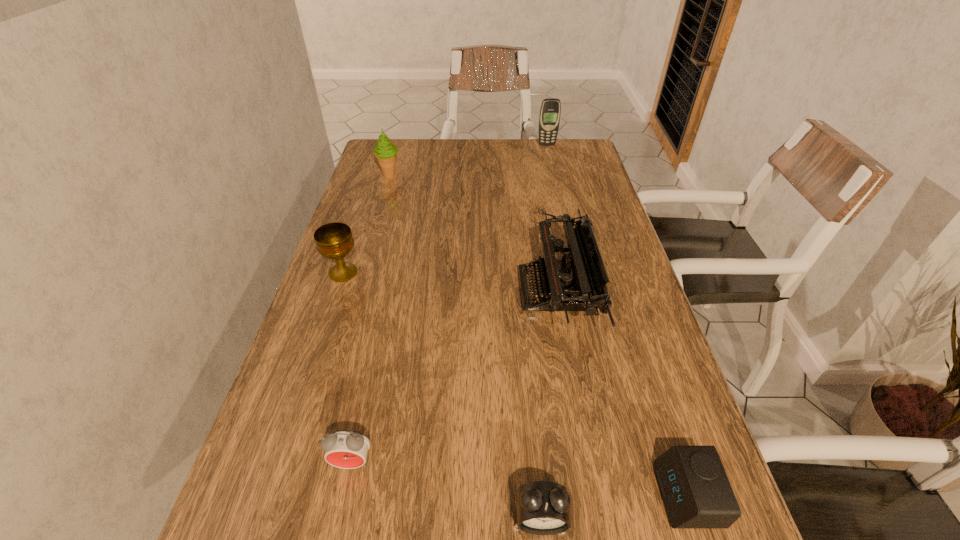
At what (x,y) coordinates should I click in order to perform the action: click on free region located on the typing side of the typewriter. Please return your answer as a coordinate pair (x, y). The height and width of the screenshot is (540, 960). Looking at the image, I should click on pyautogui.click(x=395, y=291).

Identify the location of vacant space located 0.260m on the typing side of the typewriter. The width and height of the screenshot is (960, 540). (412, 291).

At what (x,y) coordinates should I click in order to perform the action: click on vacant point located 0.390m on the typing side of the typewriter. Please return your answer as a coordinate pair (x, y). This screenshot has width=960, height=540. Looking at the image, I should click on (357, 291).

You are a GUI agent. You are given a task and a screenshot of the screen. Output one action in this format:
    pyautogui.click(x=<x>, y=<y>)
    Task: Click on the free space located 0.370m on the back of the chalice
    
    Given the screenshot: What is the action you would take?
    pyautogui.click(x=372, y=185)

At what (x,y) coordinates should I click in order to perform the action: click on vacant area located on the face of the third object from left to right. Please return your answer as a coordinate pair (x, y). The image size is (960, 540). Looking at the image, I should click on (344, 505).

You are a GUI agent. You are given a task and a screenshot of the screen. Output one action in this format:
    pyautogui.click(x=<x>, y=<y>)
    Task: Click on the free space located on the front-facing side of the rightmost alarm clock
    Image resolution: width=960 pixels, height=540 pixels.
    Given the screenshot: What is the action you would take?
    pyautogui.click(x=420, y=495)

Locate an element on the screen. The image size is (960, 540). vacant position located 0.060m on the front-facing side of the rightmost alarm clock is located at coordinates (623, 495).

Where is `free space located 0.360m on the front-facing side of the rightmost alarm clock`? The height and width of the screenshot is (540, 960). free space located 0.360m on the front-facing side of the rightmost alarm clock is located at coordinates (438, 495).

I want to click on cellular telephone that is at the far edge, so click(x=550, y=110).

This screenshot has width=960, height=540. What are the coordinates of `icecream that is at the far edge` in the screenshot? It's located at (385, 152).